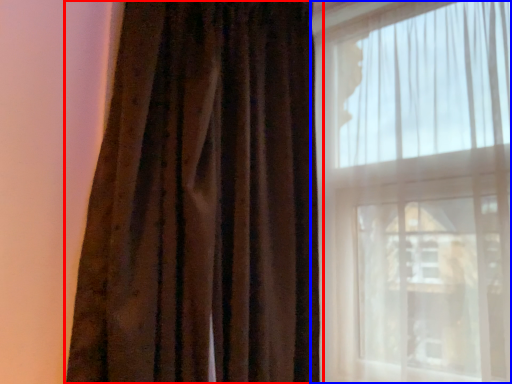
Question: Among these objects, which one is farthest to the camera, curtain (highlighted by a red box) or window (highlighted by a blue box)?

Choices:
 (A) curtain
 (B) window

Answer: (B)